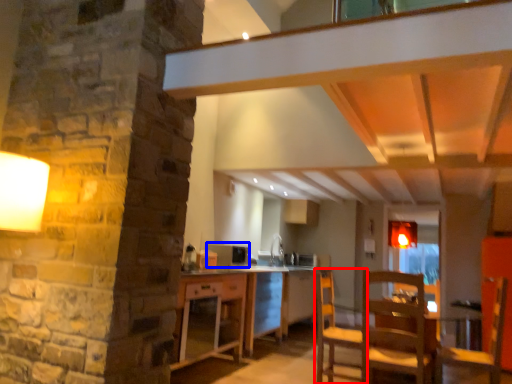
Question: Which object appears closest to the camera in this image, chair (highlighted by a red box) or appliance (highlighted by a blue box)?

Choices:
 (A) chair
 (B) appliance

Answer: (A)